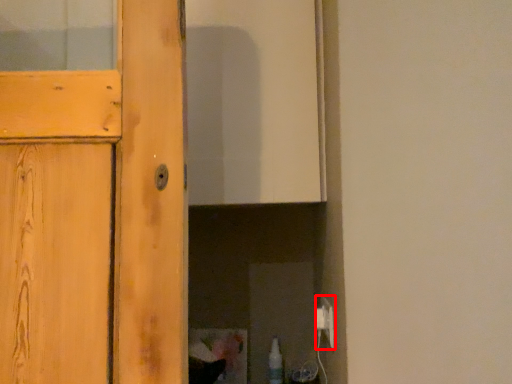
Question: From the image's perspective, considering the relative positions of electric outlet (annotated by the red box) and bottle in the image provided, where is electric outlet (annotated by the red box) located with respect to the staircase?

Choices:
 (A) above
 (B) below

Answer: (A)